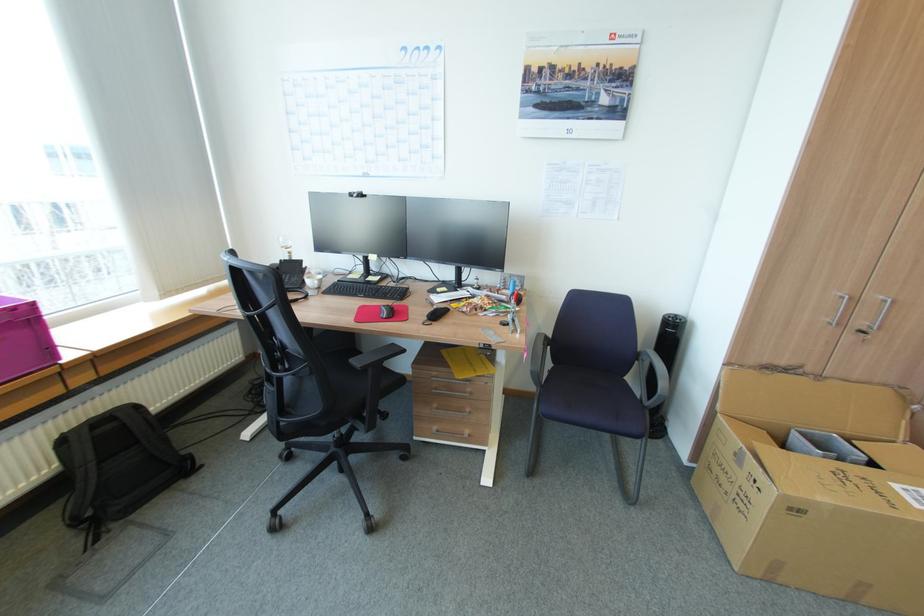
Where would you sit the black chair sitting surface? Please return your answer as a coordinate pair (x, y).

(345, 379)